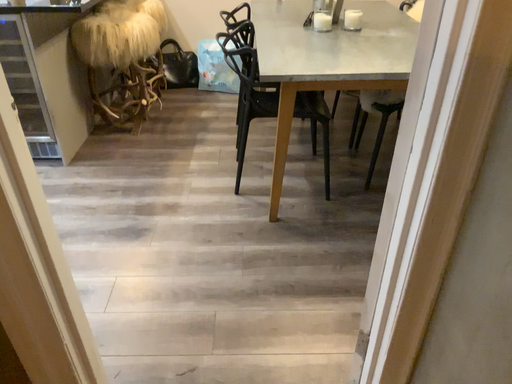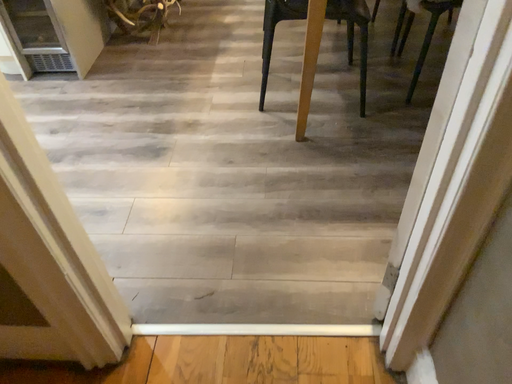
Question: How did the camera likely rotate when shooting the video?

Choices:
 (A) rotated downward
 (B) rotated upward

Answer: (A)